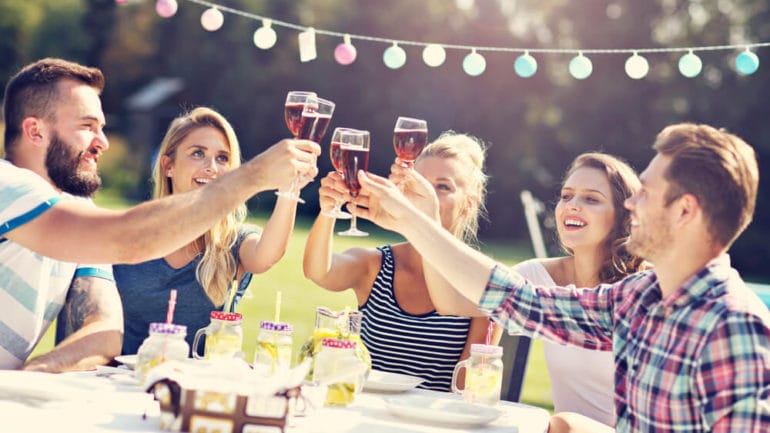
You are a GUI agent. You are given a task and a screenshot of the screen. Output one action in this format:
    pyautogui.click(x=<x>, y=<y>)
    Task: Click on the glasses of wine
    The height and width of the screenshot is (433, 770).
    Given the screenshot: What is the action you would take?
    pyautogui.click(x=290, y=109), pyautogui.click(x=312, y=116), pyautogui.click(x=333, y=151), pyautogui.click(x=350, y=154), pyautogui.click(x=410, y=140)